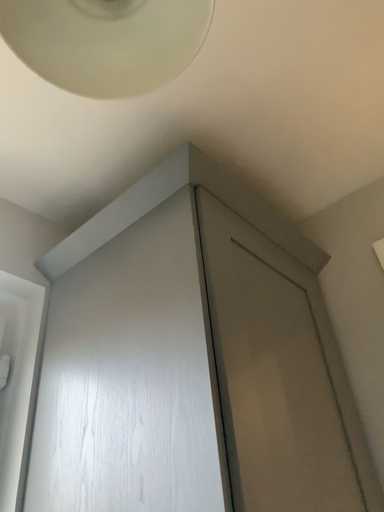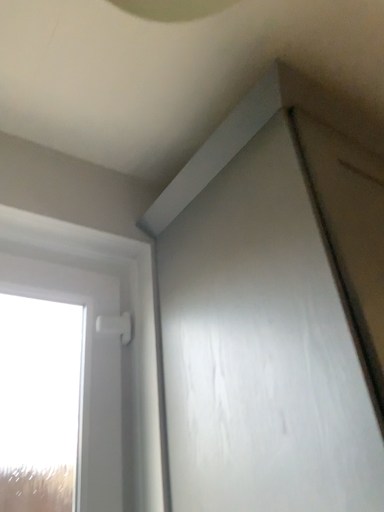
Question: Which way did the camera rotate in the video?

Choices:
 (A) rotated right
 (B) rotated left

Answer: (B)